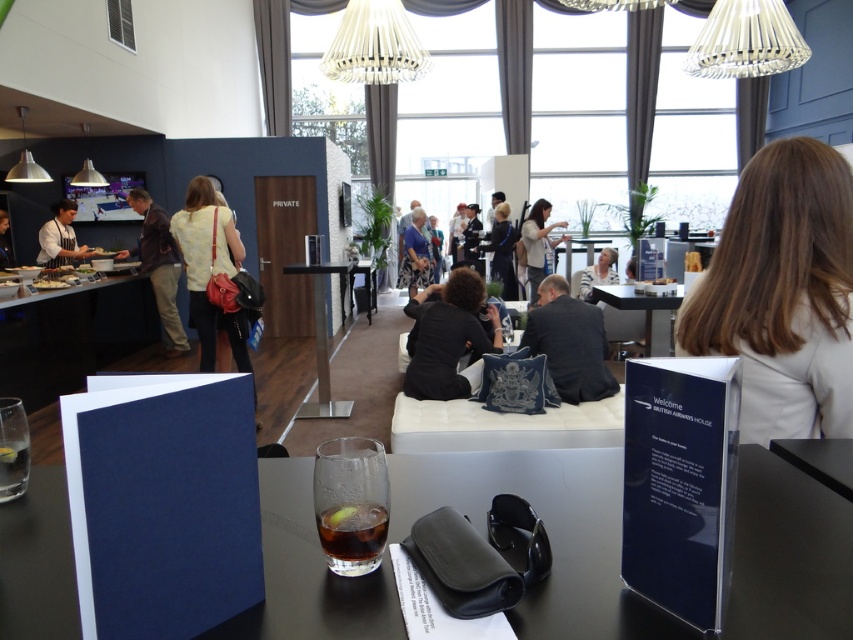
In the scene shown: Does yellow fabric shirt at center come behind white woven chandelier at upper center?

No, it is in front of white woven chandelier at upper center.

Does yellow fabric shirt at center appear on the right side of white woven chandelier at upper center?

Incorrect, yellow fabric shirt at center is not on the right side of white woven chandelier at upper center.

Does point (207, 234) come farther from viewer compared to point (740, 29)?

No, (207, 234) is in front of (740, 29).

Where is `yellow fabric shirt at center`? yellow fabric shirt at center is located at coordinates (210, 269).

Does point (714, 19) lie in front of point (424, 273)?

Yes, it is.

Is white woven chandelier at upper center to the right of light blue shirt at center from the viewer's perspective?

Indeed, white woven chandelier at upper center is positioned on the right side of light blue shirt at center.

Identify the location of white woven chandelier at upper center. (746, 40).

Identify the location of white woven chandelier at upper center. (746, 40).

Consider the image. Which of these two, silver metallic table at center or wooden table at center, stands shorter?

wooden table at center is shorter.

Which is in front, point (344, 408) or point (627, 288)?

Positioned in front is point (627, 288).

The width and height of the screenshot is (853, 640). I want to click on silver metallic table at center, so click(x=326, y=332).